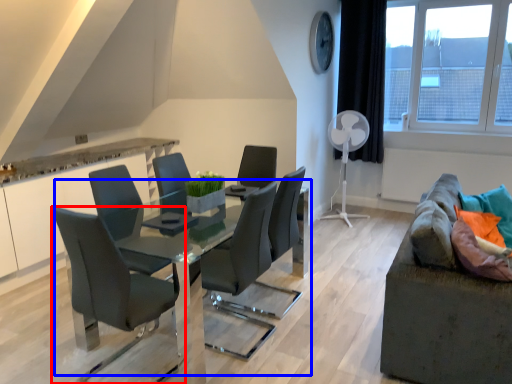
Question: Among these objects, which one is nearest to the camera, chair (highlighted by a red box) or table (highlighted by a blue box)?

Choices:
 (A) chair
 (B) table

Answer: (A)